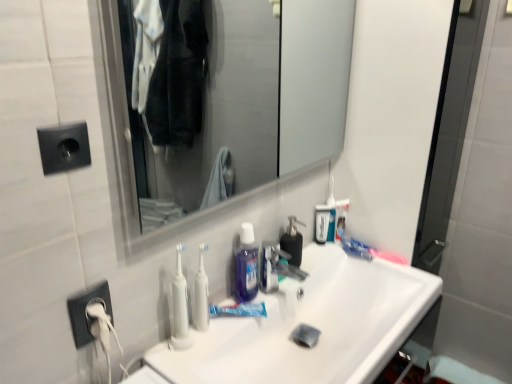
Where is `free spot to the left of pink plastic toothbrush at upper right, acting as the 2th toothbrush starting from the front`? free spot to the left of pink plastic toothbrush at upper right, acting as the 2th toothbrush starting from the front is located at coordinates (338, 262).